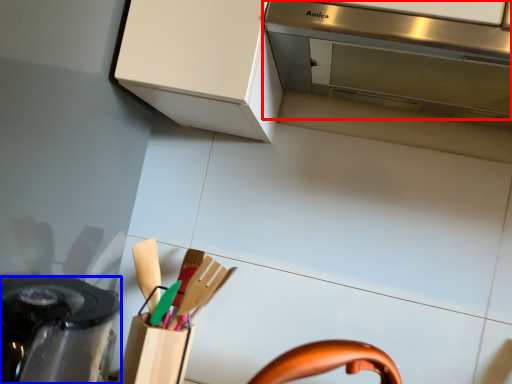
Question: Among these objects, which one is farthest to the camera, home appliance (highlighted by a red box) or kitchen appliance (highlighted by a blue box)?

Choices:
 (A) home appliance
 (B) kitchen appliance

Answer: (A)